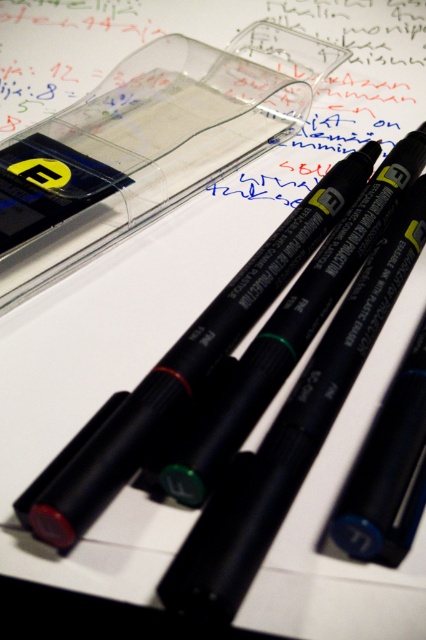
Between point (224, 301) and point (65, 522), which one is positioned behind?

The point (224, 301) is behind.

Who is lower down, matte black pen at center or rubber eraser at lower left?

rubber eraser at lower left is below.

Image resolution: width=426 pixels, height=640 pixels. I want to click on matte black pen at center, so click(x=192, y=356).